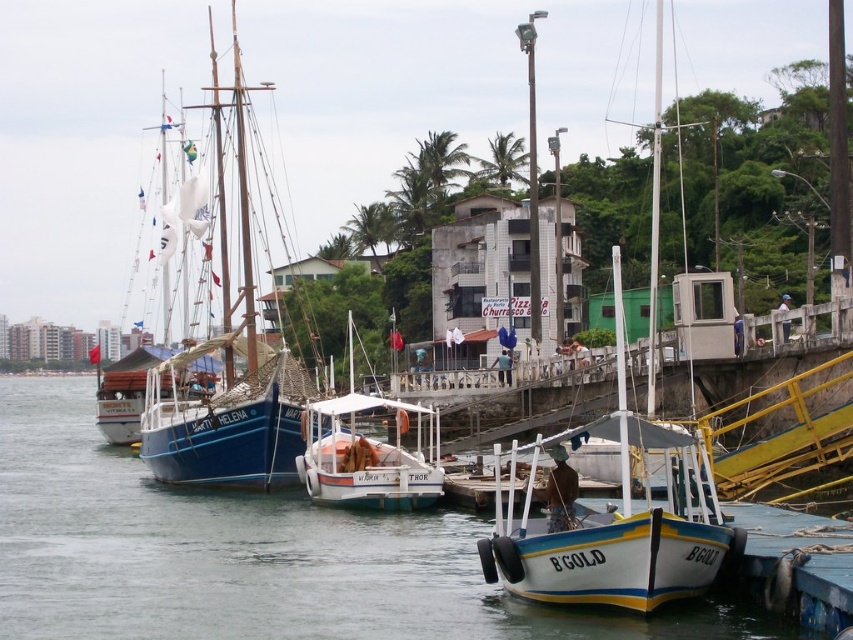
You are a sailor planning to dock your boat at the harbor. You see the clear water at boat right and the white matte sailboat at center. Which object takes up more space in the image?

The white matte sailboat at center takes up more space in the image because the clear water at boat right is smaller than it.